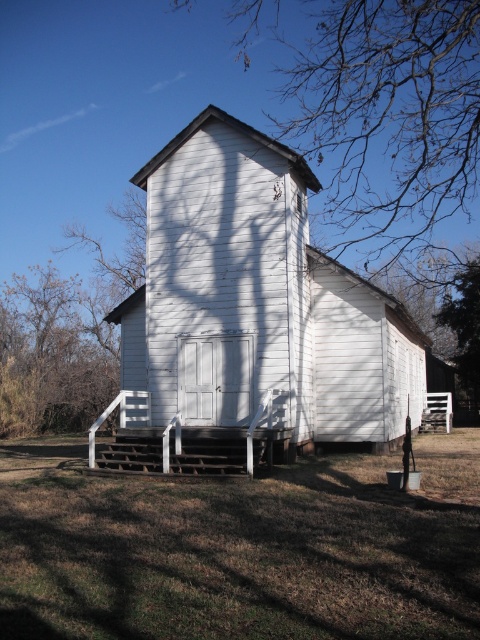
Question: Among these objects, which one is farthest from the camera?

Choices:
 (A) white wooden church at center
 (B) bare branches at upper center
 (C) green leafy tree at right

Answer: (C)

Question: Which point is closer to the camera taking this photo?

Choices:
 (A) (333, 154)
 (B) (468, 388)

Answer: (B)

Question: In this image, where is white wooden church at center located relative to bare branches at upper center?

Choices:
 (A) below
 (B) above

Answer: (A)

Question: Which object is farther from the camera taking this photo?

Choices:
 (A) green leafy tree at right
 (B) white wooden church at center
 (C) bare branches at upper center

Answer: (A)

Question: Can you confirm if white wooden church at center is positioned to the left of bare branches at upper center?

Choices:
 (A) no
 (B) yes

Answer: (B)

Question: Is white wooden church at center bigger than green leafy tree at right?

Choices:
 (A) no
 (B) yes

Answer: (B)